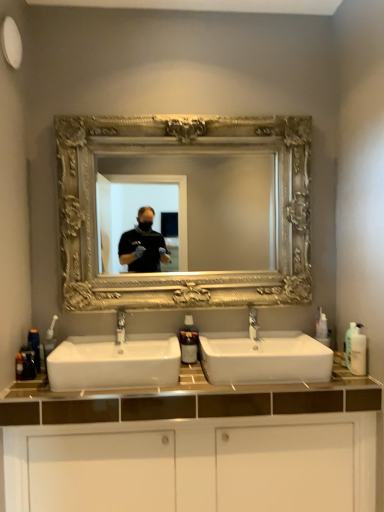
Question: Is gold ornate mirror at center next to white plastic bottle at right, the 1th toiletry in the right-to-left sequence, and touching it?

Choices:
 (A) yes
 (B) no

Answer: (B)

Question: Is gold ornate mirror at center far away from white plastic bottle at right, arranged as the 3th toiletry when viewed from the left?

Choices:
 (A) no
 (B) yes

Answer: (B)

Question: Is gold ornate mirror at center positioned with its back to white plastic bottle at right, arranged as the 3th toiletry when viewed from the left?

Choices:
 (A) yes
 (B) no

Answer: (B)

Question: Can you confirm if gold ornate mirror at center is bigger than white plastic bottle at right, the 1th toiletry in the right-to-left sequence?

Choices:
 (A) no
 (B) yes

Answer: (B)

Question: Is gold ornate mirror at center not within white plastic bottle at right, arranged as the 3th toiletry when viewed from the left?

Choices:
 (A) yes
 (B) no

Answer: (A)

Question: From a real-world perspective, is white plastic bottle at right, arranged as the 3th toiletry when viewed from the left, positioned above or below white ceramic sink at center, acting as the 1th sink starting from the left?

Choices:
 (A) above
 (B) below

Answer: (A)

Question: Considering their positions, is white plastic bottle at right, the 1th toiletry in the right-to-left sequence, located in front of or behind white ceramic sink at center, which is the 2th sink in right-to-left order?

Choices:
 (A) behind
 (B) front

Answer: (A)

Question: Based on their sizes in the image, would you say white plastic bottle at right, arranged as the 3th toiletry when viewed from the left, is bigger or smaller than white ceramic sink at center, acting as the 1th sink starting from the left?

Choices:
 (A) big
 (B) small

Answer: (B)

Question: From the image's perspective, is white plastic bottle at right, arranged as the 3th toiletry when viewed from the left, above or below white ceramic sink at center, which is the 2th sink in right-to-left order?

Choices:
 (A) above
 (B) below

Answer: (A)

Question: In terms of height, does gold ornate mirror at center look taller or shorter compared to white ceramic sink at center, which is the first sink in right-to-left order?

Choices:
 (A) short
 (B) tall

Answer: (B)

Question: Does point coord(215,138) appear closer or farther from the camera than point coord(297,330)?

Choices:
 (A) farther
 (B) closer

Answer: (B)

Question: In terms of size, does gold ornate mirror at center appear bigger or smaller than white ceramic sink at center, marked as the second sink in a left-to-right arrangement?

Choices:
 (A) big
 (B) small

Answer: (A)

Question: Considering the positions of gold ornate mirror at center and white ceramic sink at center, marked as the second sink in a left-to-right arrangement, in the image, is gold ornate mirror at center wider or thinner than white ceramic sink at center, marked as the second sink in a left-to-right arrangement,?

Choices:
 (A) wide
 (B) thin

Answer: (B)

Question: Is gold ornate mirror at center in front of or behind white plastic bottle at right, arranged as the 3th toiletry when viewed from the left, in the image?

Choices:
 (A) behind
 (B) front

Answer: (A)

Question: Considering the positions of gold ornate mirror at center and white plastic bottle at right, the 1th toiletry in the right-to-left sequence, in the image, is gold ornate mirror at center wider or thinner than white plastic bottle at right, the 1th toiletry in the right-to-left sequence,?

Choices:
 (A) thin
 (B) wide

Answer: (B)